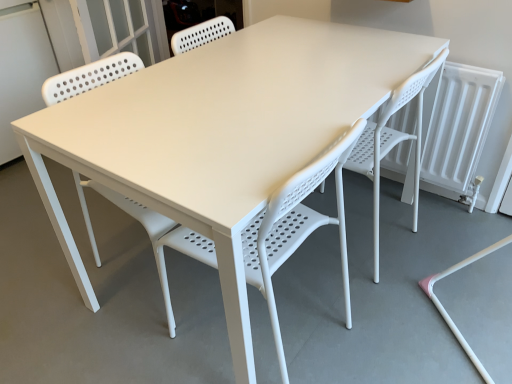
Image resolution: width=512 pixels, height=384 pixels. I want to click on vacant space to the right of white plastic chair at center, which appears as the second chair when viewed from the right, so click(x=385, y=327).